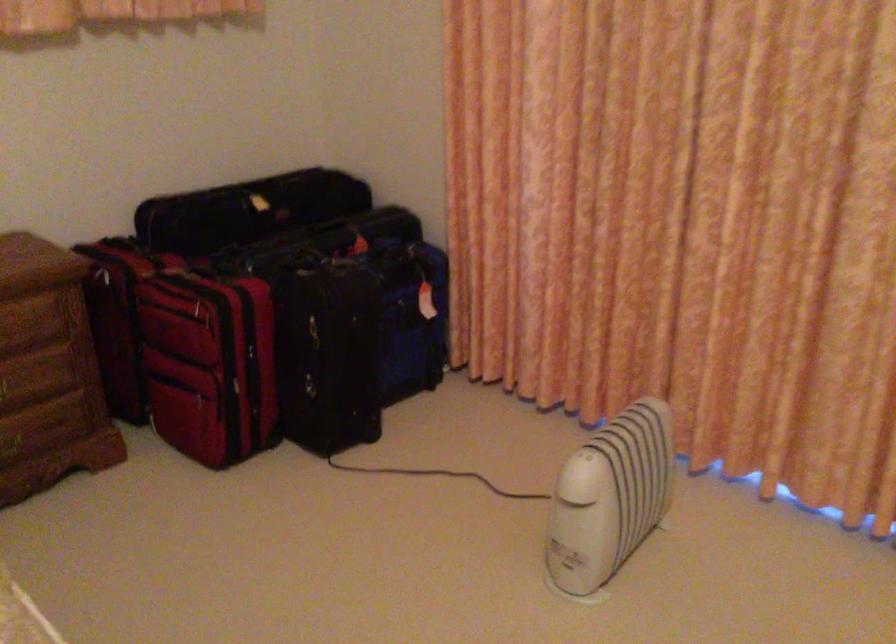
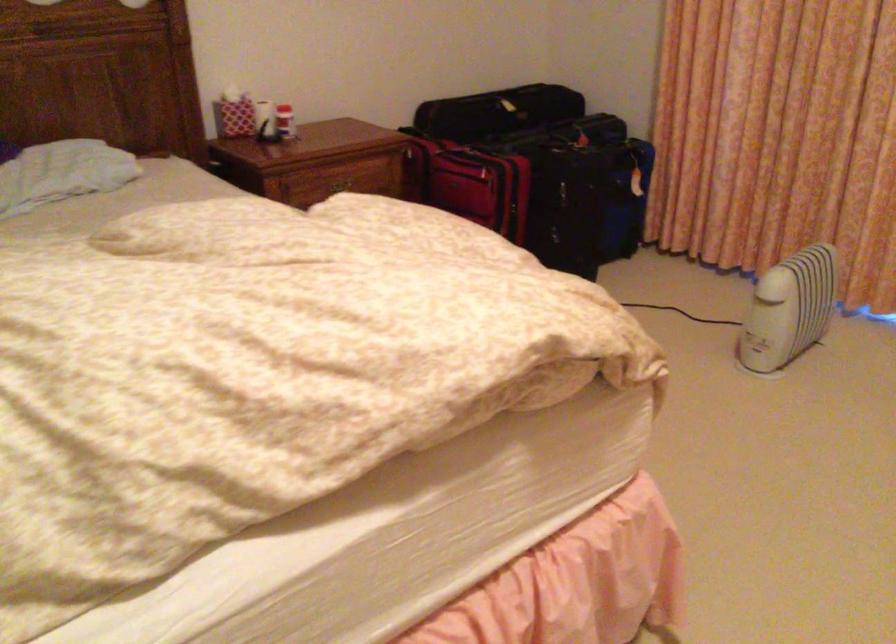
The point at (x=602, y=524) is marked in the first image. Where is the corresponding point in the second image?

(789, 308)